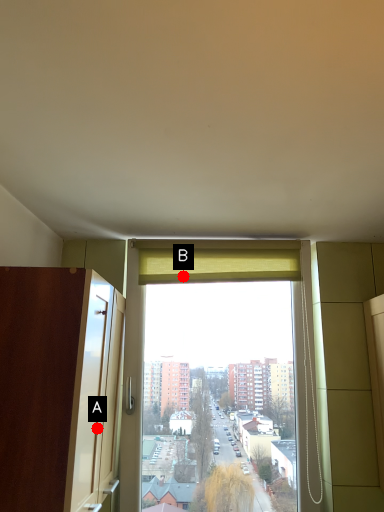
Question: Two points are circled on the image, labeled by A and B beside each circle. Which point is farther to the camera?

Choices:
 (A) A is further
 (B) B is further

Answer: (B)